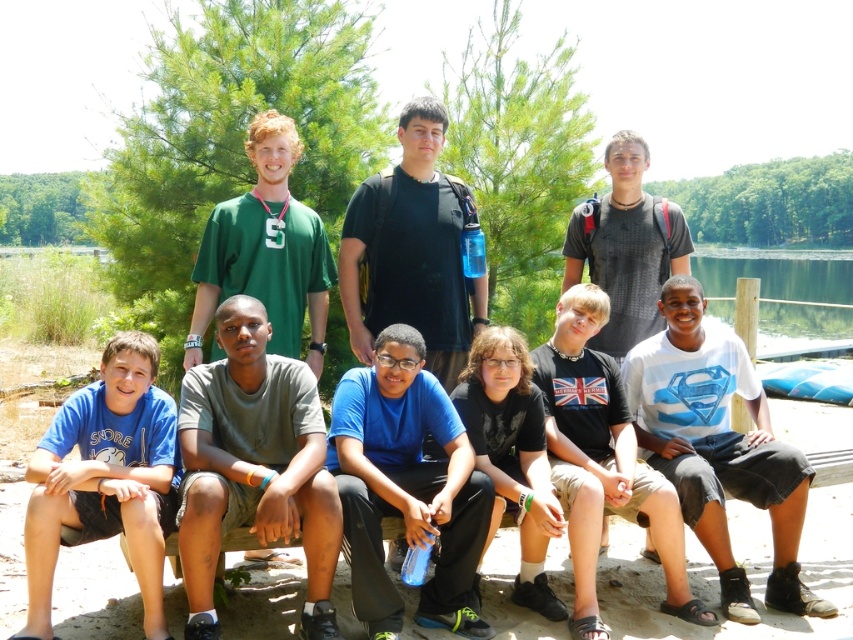
Is blue cotton shirt at lower left to the left of black matte shirt at upper center from the viewer's perspective?

Correct, you'll find blue cotton shirt at lower left to the left of black matte shirt at upper center.

Is point (91, 449) less distant than point (569, 282)?

Yes, it is in front of point (569, 282).

Who is more distant from viewer, (78, 532) or (624, 340)?

Positioned behind is point (624, 340).

Find the location of `blue cotton shirt at lower left`. blue cotton shirt at lower left is located at coordinates (105, 480).

Is point (584, 362) closer to camera compared to point (640, 310)?

Yes.

Is white cotton shirt at center closer to camera compared to black matte shirt at upper center?

Yes.

Is point (578, 627) behind point (624, 244)?

No, (578, 627) is in front of (624, 244).

Identify the location of white cotton shirt at center. (601, 460).

Is point (242, 518) positioned behind point (740, 602)?

No, it is not.

Is the position of gray cotton shirt at center more distant than that of white cotton shirt at lower right?

No, it is not.

Does point (231, 508) come in front of point (651, 451)?

That is True.

Where is `gray cotton shirt at center`? The height and width of the screenshot is (640, 853). gray cotton shirt at center is located at coordinates pyautogui.click(x=254, y=465).